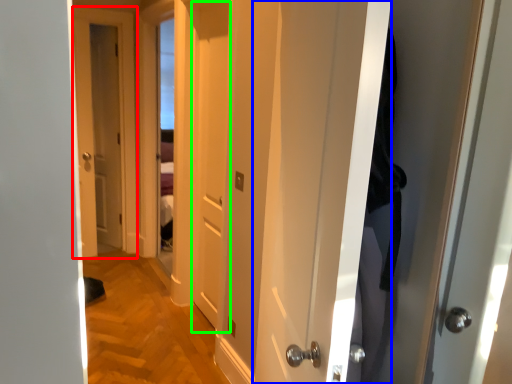
Question: Which object is positioned closest to door (highlighted by a red box)? Select from door (highlighted by a blue box) and door (highlighted by a green box).

Choices:
 (A) door
 (B) door

Answer: (B)